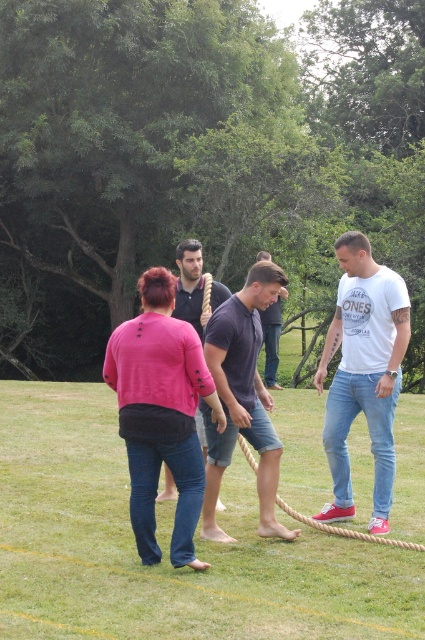
Question: Is pink fabric shirt at center smaller than smooth blue jeans at center?

Choices:
 (A) yes
 (B) no

Answer: (A)

Question: Which of the following is the closest to the observer?

Choices:
 (A) (243, 333)
 (B) (385, 376)
 (C) (198, 323)

Answer: (A)

Question: Which point is farther from the camera taking this photo?

Choices:
 (A) (255, 435)
 (B) (343, 458)

Answer: (B)

Question: Can you confirm if smooth blue jeans at center is positioned below rope at center?

Choices:
 (A) yes
 (B) no

Answer: (B)

Question: Is pink fabric shirt at center thinner than smooth blue jeans at center?

Choices:
 (A) no
 (B) yes

Answer: (B)

Question: Which point is closer to the camera taking this photo?

Choices:
 (A) (268, 333)
 (B) (240, 333)
 (C) (351, 385)

Answer: (B)